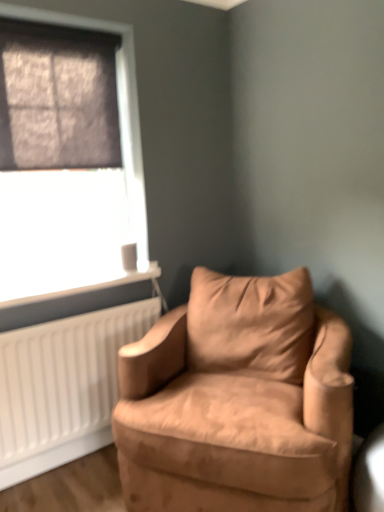
The height and width of the screenshot is (512, 384). Describe the element at coordinates (238, 401) in the screenshot. I see `suede-like tan armchair at center` at that location.

Measure the distance between point (35, 294) and camera.

The depth of point (35, 294) is 6.25 feet.

What is the approximate width of white plastic radiator at lower left?

11.02 inches.

In order to face dark matte window screen at upper left, should I rotate leftwards or rightwards?

A 16.828 degree turn to the left will do.

Identify the location of suede-like tan armchair at center. The height and width of the screenshot is (512, 384). (238, 401).

Is suede-like tan armchair at center at the back of white plastic radiator at lower left?

No, white plastic radiator at lower left's orientation is not away from suede-like tan armchair at center.

How different are the orientations of white plastic radiator at lower left and suede-like tan armchair at center in degrees?

61.5 degrees.

Considering their positions, is white plastic radiator at lower left located in front of or behind suede-like tan armchair at center?

Clearly, white plastic radiator at lower left is behind suede-like tan armchair at center.

Considering the sizes of white plastic radiator at lower left and suede-like tan armchair at center in the image, is white plastic radiator at lower left bigger or smaller than suede-like tan armchair at center?

Considering their sizes, white plastic radiator at lower left takes up less space than suede-like tan armchair at center.

Does white plastic radiator at lower left have a lesser height compared to matte black window at upper left?

Yes, white plastic radiator at lower left is shorter than matte black window at upper left.

Between white plastic radiator at lower left and matte black window at upper left, which one has larger width?

Wider between the two is white plastic radiator at lower left.

Looking at this image, would you consider white plastic radiator at lower left to be distant from matte black window at upper left?

No, there isn't a large distance between white plastic radiator at lower left and matte black window at upper left.

This screenshot has height=512, width=384. I want to click on window sill that appears on the left of suede-like tan armchair at center, so click(x=74, y=284).

Which of these two, suede-like tan armchair at center or white plastic radiator at lower left, stands taller?

Standing taller between the two is suede-like tan armchair at center.

In the scene shown: Is the surface of suede-like tan armchair at center in direct contact with white plastic radiator at lower left?

No, suede-like tan armchair at center is not in contact with white plastic radiator at lower left.

Is suede-like tan armchair at center with matte black window at upper left?

No, suede-like tan armchair at center is not making contact with matte black window at upper left.

This screenshot has width=384, height=512. Find the location of `window on the left of suede-like tan armchair at center`. window on the left of suede-like tan armchair at center is located at coordinates (75, 203).

Does suede-like tan armchair at center have a lesser height compared to matte black window at upper left?

Indeed, suede-like tan armchair at center has a lesser height compared to matte black window at upper left.

Is matte black window at upper left not close to dark matte window screen at upper left?

That's not correct — matte black window at upper left is a little close to dark matte window screen at upper left.

From a real-world perspective, between matte black window at upper left and dark matte window screen at upper left, who is vertically lower?

matte black window at upper left is physically lower.

Is matte black window at upper left completely or partially outside of dark matte window screen at upper left?

matte black window at upper left is positioned outside dark matte window screen at upper left.

Does point (324, 421) come behind point (67, 149)?

No, (324, 421) is in front of (67, 149).

In the image, is suede-like tan armchair at center positioned in front of or behind dark matte window screen at upper left?

suede-like tan armchair at center is positioned closer to the viewer than dark matte window screen at upper left.

Looking at their sizes, would you say suede-like tan armchair at center is wider or thinner than dark matte window screen at upper left?

In the image, suede-like tan armchair at center appears to be wider than dark matte window screen at upper left.

Can you confirm if suede-like tan armchair at center is shorter than dark matte window screen at upper left?

In fact, suede-like tan armchair at center may be taller than dark matte window screen at upper left.

How many degrees apart are the facing directions of matte black window at upper left and suede-like tan armchair at center?

matte black window at upper left and suede-like tan armchair at center are facing 61.6 degrees away from each other.

Between matte black window at upper left and suede-like tan armchair at center, which one has larger size?

suede-like tan armchair at center is bigger.

Considering their positions, is matte black window at upper left located in front of or behind suede-like tan armchair at center?

Visually, matte black window at upper left is located behind suede-like tan armchair at center.

Which of these two, matte black window at upper left or suede-like tan armchair at center, stands taller?

Standing taller between the two is matte black window at upper left.

Locate an element on the screen. The width and height of the screenshot is (384, 512). chair on the right of the white plastic radiator at lower left is located at coordinates (238, 401).

This screenshot has width=384, height=512. Identify the location of window sill in front of the matte black window at upper left. (74, 284).

Estimate the real-world distances between objects in this image. Which object is closer to matte black window at upper left, suede-like tan armchair at center or dark matte window screen at upper left?

Among the two, dark matte window screen at upper left is located nearer to matte black window at upper left.

Considering their positions, is dark matte window screen at upper left positioned closer to matte black window at upper left than suede-like tan armchair at center?

Among the two, dark matte window screen at upper left is located nearer to matte black window at upper left.

Based on their spatial positions, is matte black window at upper left or dark matte window screen at upper left closer to suede-like tan armchair at center?

matte black window at upper left is closer to suede-like tan armchair at center.

When comparing their distances from suede-like tan armchair at center, does dark matte window screen at upper left or matte black window at upper left seem closer?

matte black window at upper left lies closer to suede-like tan armchair at center than the other object.

Estimate the real-world distances between objects in this image. Which object is closer to dark matte window screen at upper left, white plastic radiator at lower left or suede-like tan armchair at center?

The object closer to dark matte window screen at upper left is white plastic radiator at lower left.

Looking at the image, which one is located further to dark matte window screen at upper left, white plastic radiator at lower left or matte black window at upper left?

white plastic radiator at lower left is positioned further to the anchor dark matte window screen at upper left.

Based on their spatial positions, is white plastic radiator at lower left or suede-like tan armchair at center closer to matte black window at upper left?

Based on the image, white plastic radiator at lower left appears to be nearer to matte black window at upper left.

When comparing their distances from suede-like tan armchair at center, does matte black window at upper left or white plastic radiator at lower left seem further?

matte black window at upper left is positioned further to the anchor suede-like tan armchair at center.

Find the location of a particular element. window sill between matte black window at upper left and suede-like tan armchair at center from top to bottom is located at coordinates (74, 284).

Locate an element on the screen. The width and height of the screenshot is (384, 512). window between dark matte window screen at upper left and suede-like tan armchair at center in the vertical direction is located at coordinates (75, 203).

Where is `window that lies between dark matte window screen at upper left and white plastic radiator at lower left from top to bottom`? window that lies between dark matte window screen at upper left and white plastic radiator at lower left from top to bottom is located at coordinates (75, 203).

Locate an element on the screen. window sill between dark matte window screen at upper left and suede-like tan armchair at center in the vertical direction is located at coordinates (74, 284).